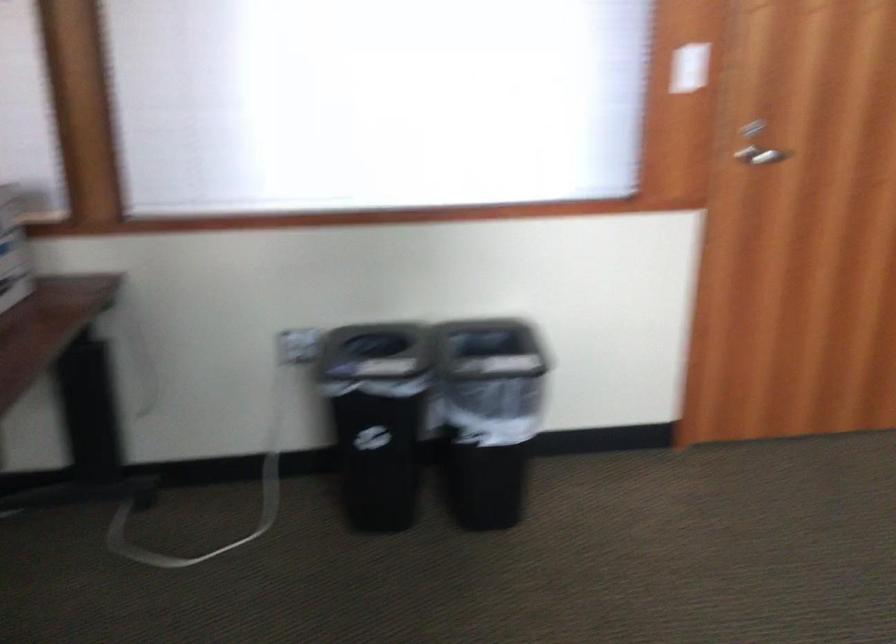
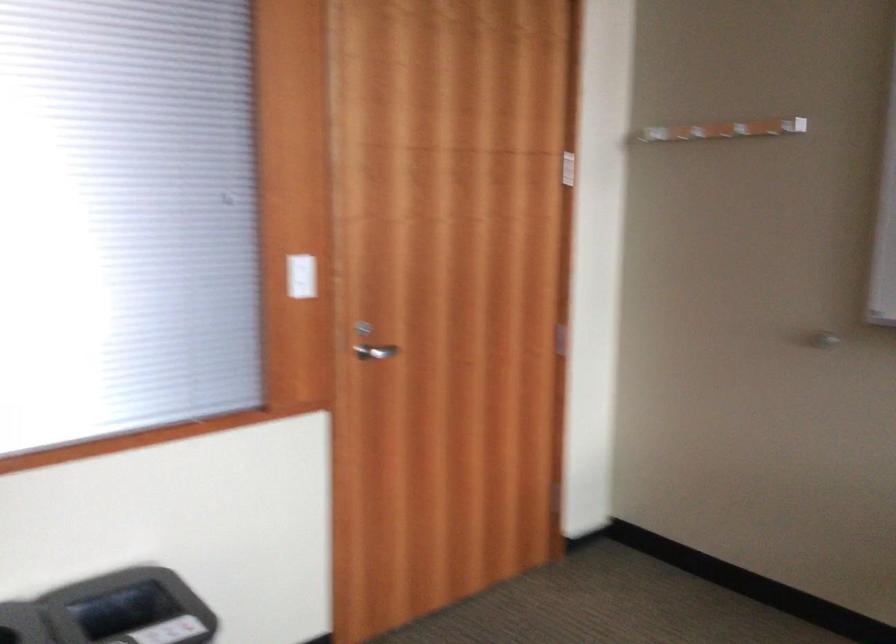
Question: Based on the continuous images, in which direction is the camera rotating? Reply with the corresponding letter.

Choices:
 (A) Left
 (B) Right
 (C) Up
 (D) Down

Answer: (B)